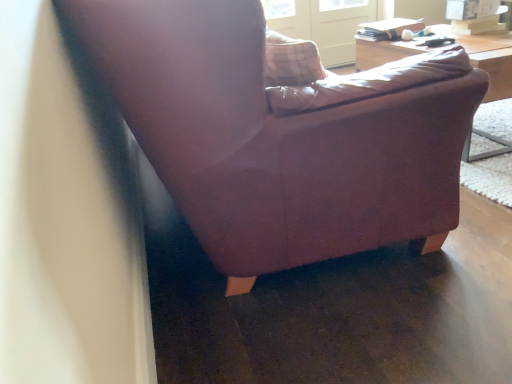
In the scene shown: Measure the distance between point (511,63) and camera.

1.78 meters.

The width and height of the screenshot is (512, 384). Describe the element at coordinates (277, 138) in the screenshot. I see `matte purple armchair at center` at that location.

Find the location of `wooden table at upper right`. wooden table at upper right is located at coordinates (488, 58).

Is wooden table at upper right to the right of matte purple armchair at center from the viewer's perspective?

Yes.

Is wooden table at upper right oriented towards matte purple armchair at center?

No, wooden table at upper right is not aimed at matte purple armchair at center.

Is point (477, 55) positioned before point (285, 231)?

That is False.

From the image's perspective, is wooden table at upper right positioned above or below matte purple armchair at center?

Based on their image positions, wooden table at upper right is located above matte purple armchair at center.

Considering the sizes of wooden table at upper right and clear glass screen door at upper center in the image, is wooden table at upper right wider or thinner than clear glass screen door at upper center?

In the image, wooden table at upper right appears to be wider than clear glass screen door at upper center.

Does wooden table at upper right have a smaller size compared to clear glass screen door at upper center?

Actually, wooden table at upper right might be larger than clear glass screen door at upper center.

Does wooden table at upper right have a lesser height compared to clear glass screen door at upper center?

Yes, wooden table at upper right is shorter than clear glass screen door at upper center.

Is the depth of wooden table at upper right less than that of clear glass screen door at upper center?

Yes, the depth of wooden table at upper right is less than that of clear glass screen door at upper center.

Does clear glass screen door at upper center have a smaller size compared to wooden table at upper right?

Indeed, clear glass screen door at upper center has a smaller size compared to wooden table at upper right.

Locate an element on the screen. Image resolution: width=512 pixels, height=384 pixels. table that is in front of the clear glass screen door at upper center is located at coordinates (488, 58).

Is clear glass screen door at upper center inside the boundaries of wooden table at upper right, or outside?

clear glass screen door at upper center is located beyond the bounds of wooden table at upper right.

Does clear glass screen door at upper center lie in front of wooden table at upper right?

No, clear glass screen door at upper center is behind wooden table at upper right.

Consider the image. Who is bigger, matte purple armchair at center or wooden table at upper right?

With larger size is wooden table at upper right.

Considering the sizes of matte purple armchair at center and wooden table at upper right in the image, is matte purple armchair at center taller or shorter than wooden table at upper right?

Considering their sizes, matte purple armchair at center has less height than wooden table at upper right.

How many degrees apart are the facing directions of matte purple armchair at center and wooden table at upper right?

There is a 179-degree angle between the facing directions of matte purple armchair at center and wooden table at upper right.

How distant is matte purple armchair at center from clear glass screen door at upper center?

9.67 feet.

Which object is thinner, matte purple armchair at center or clear glass screen door at upper center?

clear glass screen door at upper center.

Would you say matte purple armchair at center is outside clear glass screen door at upper center?

Yes, matte purple armchair at center is outside of clear glass screen door at upper center.

From the image's perspective, would you say clear glass screen door at upper center is shown under matte purple armchair at center?

No.

From a real-world perspective, relative to matte purple armchair at center, is clear glass screen door at upper center vertically above or below?

In terms of real-world spatial position, clear glass screen door at upper center is above matte purple armchair at center.

Can we say clear glass screen door at upper center lies outside matte purple armchair at center?

Yes, clear glass screen door at upper center is not within matte purple armchair at center.

Locate an element on the screen. chair located below the wooden table at upper right (from the image's perspective) is located at coordinates (277, 138).

At what (x,y) coordinates should I click in order to perform the action: click on screen door to the left of wooden table at upper right. Please return your answer as a coordinate pair (x, y). Looking at the image, I should click on (322, 24).

Considering their positions, is matte purple armchair at center positioned closer to wooden table at upper right than clear glass screen door at upper center?

matte purple armchair at center is closer to wooden table at upper right.

When comparing their distances from matte purple armchair at center, does clear glass screen door at upper center or wooden table at upper right seem further?

clear glass screen door at upper center is further to matte purple armchair at center.

Based on their spatial positions, is clear glass screen door at upper center or matte purple armchair at center further from wooden table at upper right?

clear glass screen door at upper center is positioned further to the anchor wooden table at upper right.

Estimate the real-world distances between objects in this image. Which object is further from matte purple armchair at center, wooden table at upper right or clear glass screen door at upper center?

Among the two, clear glass screen door at upper center is located further to matte purple armchair at center.

From the image, which object appears to be farther from clear glass screen door at upper center, wooden table at upper right or matte purple armchair at center?

matte purple armchair at center lies further to clear glass screen door at upper center than the other object.

Which object lies further to the anchor point clear glass screen door at upper center, matte purple armchair at center or wooden table at upper right?

matte purple armchair at center.

Locate an element on the screen. The height and width of the screenshot is (384, 512). table between matte purple armchair at center and clear glass screen door at upper center from front to back is located at coordinates (488, 58).